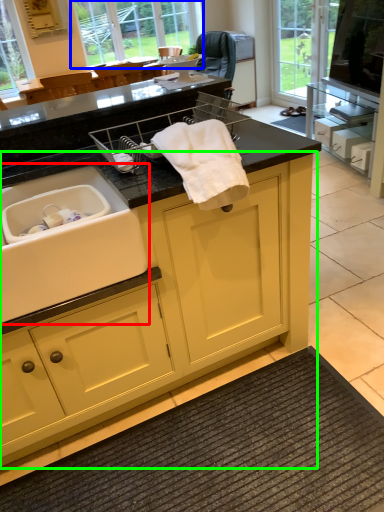
Question: Estimate the real-world distances between objects in this image. Which object is closer to sink (highlighted by a red box), window (highlighted by a blue box) or cabinetry (highlighted by a green box)?

Choices:
 (A) window
 (B) cabinetry

Answer: (B)